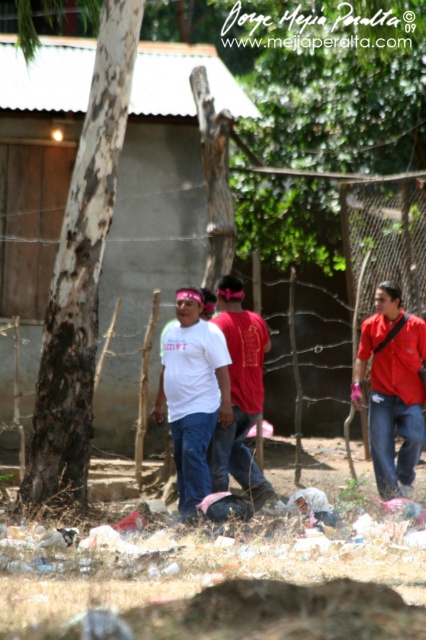
You are standing at the origin point in the image. Where is the concrete wall at center located in terms of coordinates?

The concrete wall at center is located at coordinates point (157,209).

You are standing in the scene and want to walk from the point at coordinates point (417, 275) to the point at coordinates point (201, 429). Which direction should you move relative to your current position?

You should move forward because point (417, 275) is closer to you than point (201, 429), so moving forward will take you towards it.

You are a painter who needs to set up an easel between the concrete wall at center and the brown rough bark tree at left. The easel requires a minimum of 15 feet of space between the two objects to be placed safely. Can you place your easel there?

The distance between the concrete wall at center and the brown rough bark tree at left is 16.27 feet, which is more than the required 15 feet. Therefore, you can safely place your easel there.